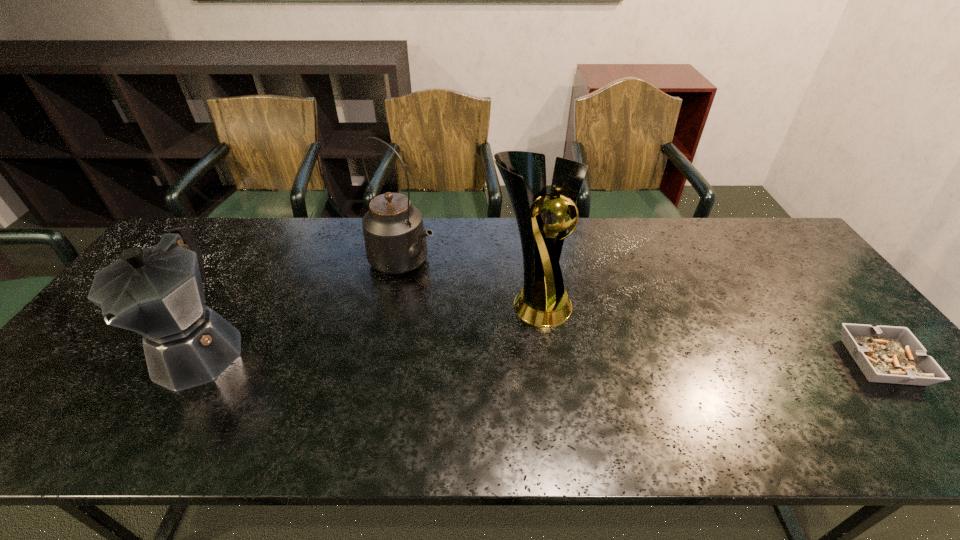
At what (x,y) coordinates should I click in order to perform the action: click on the leftmost object. Please return your answer as a coordinate pair (x, y). Looking at the image, I should click on (157, 292).

Locate an element on the screen. the second shortest object is located at coordinates (157, 292).

Locate an element on the screen. The width and height of the screenshot is (960, 540). the shortest object is located at coordinates (886, 354).

I want to click on the rightmost object, so click(x=886, y=354).

Where is `the second tallest object`? This screenshot has width=960, height=540. the second tallest object is located at coordinates (395, 240).

Image resolution: width=960 pixels, height=540 pixels. Find the location of `kettle`. kettle is located at coordinates (395, 240).

The image size is (960, 540). I want to click on award, so click(543, 302).

Where is `vacant space located on the left of the rightmost object`? Image resolution: width=960 pixels, height=540 pixels. vacant space located on the left of the rightmost object is located at coordinates (745, 362).

I want to click on vacant point located spout on the third object from right to left, so click(488, 314).

You are a GUI agent. You are given a task and a screenshot of the screen. Output one action in this format:
    pyautogui.click(x=<x>, y=<y>)
    Task: Click on the free point located 0.340m spout on the third object from right to left
    This screenshot has height=540, width=960.
    Given the screenshot: What is the action you would take?
    pyautogui.click(x=520, y=334)